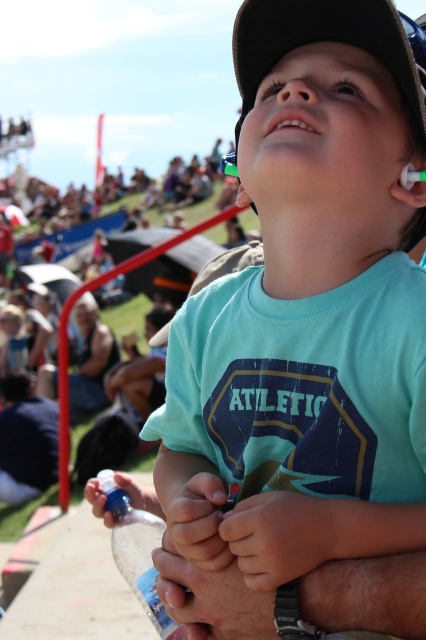
Is light blue cotton shirt at center positioned behind dark blue shirt at lower left?

No, light blue cotton shirt at center is in front of dark blue shirt at lower left.

Can you confirm if light blue cotton shirt at center is taller than dark blue shirt at lower left?

Correct, light blue cotton shirt at center is much taller as dark blue shirt at lower left.

Where is `light blue cotton shirt at center`? The width and height of the screenshot is (426, 640). light blue cotton shirt at center is located at coordinates (307, 312).

Is dark blue shirt at lower left bigger than bright white teeth at center?

Yes, dark blue shirt at lower left is bigger than bright white teeth at center.

Based on the photo, does dark blue shirt at lower left come in front of bright white teeth at center?

→ No, dark blue shirt at lower left is further to the viewer.

Which is in front, point (8, 436) or point (322, 115)?

Positioned in front is point (322, 115).

Identify the location of dark blue shirt at lower left. This screenshot has width=426, height=640. (25, 440).

Does dark blue shirt at lower left have a lesser height compared to clear plastic bottle at lower center?

No.

Measure the distance from dark blue shirt at lower left to clear plastic bottle at lower center.

The distance of dark blue shirt at lower left from clear plastic bottle at lower center is 74.76 feet.

Find the location of a particular element. Image resolution: width=426 pixels, height=640 pixels. dark blue shirt at lower left is located at coordinates (25, 440).